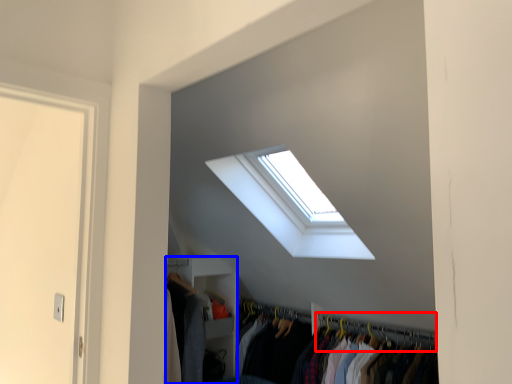
Question: Among these objects, which one is nearest to the camera, hanger (highlighted by a red box) or closet (highlighted by a blue box)?

Choices:
 (A) hanger
 (B) closet

Answer: (A)